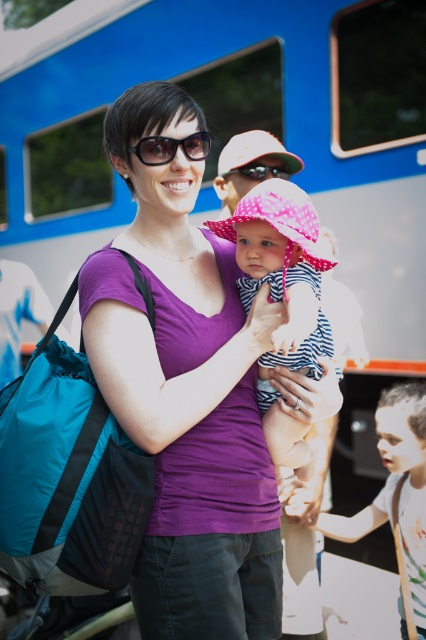
You are a photographer trying to capture a clear shot of the purple matte shirt at center and the sunglasses at center. Which object should you focus on first if you want to ensure both are in focus, considering their positions?

The purple matte shirt at center is taller than the sunglasses at center, so focusing on the purple matte shirt at center first would help ensure both are in focus as it is the larger object.

What object is located at the point with coordinates (236,132) in the image?

The point at coordinates (236,132) indicates the blue metallic train at upper center.